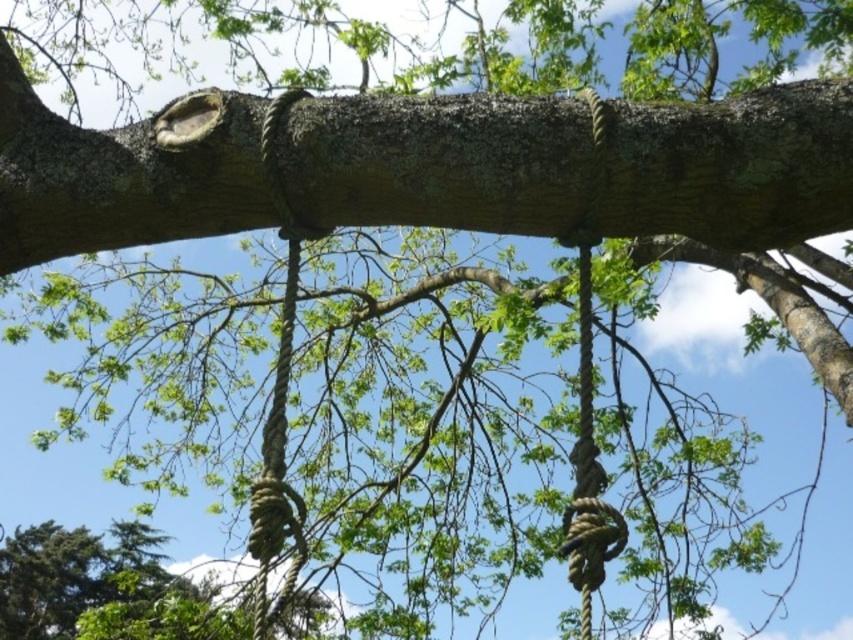
Question: Which of the following is the closest to the observer?

Choices:
 (A) rope at upper center
 (B) rough bark tree trunk at center

Answer: (A)

Question: Does rope at center have a lesser width compared to rope at upper center?

Choices:
 (A) no
 (B) yes

Answer: (A)

Question: Which object is closer to the camera taking this photo?

Choices:
 (A) rough bark tree trunk at center
 (B) rope at upper center

Answer: (B)

Question: Which of the following is the closest to the observer?

Choices:
 (A) (274, 413)
 (B) (838, 131)

Answer: (A)

Question: Does rough bark tree trunk at center have a greater width compared to rope at center?

Choices:
 (A) yes
 (B) no

Answer: (A)

Question: Does rough bark tree trunk at center have a greater width compared to rope at center?

Choices:
 (A) yes
 (B) no

Answer: (A)